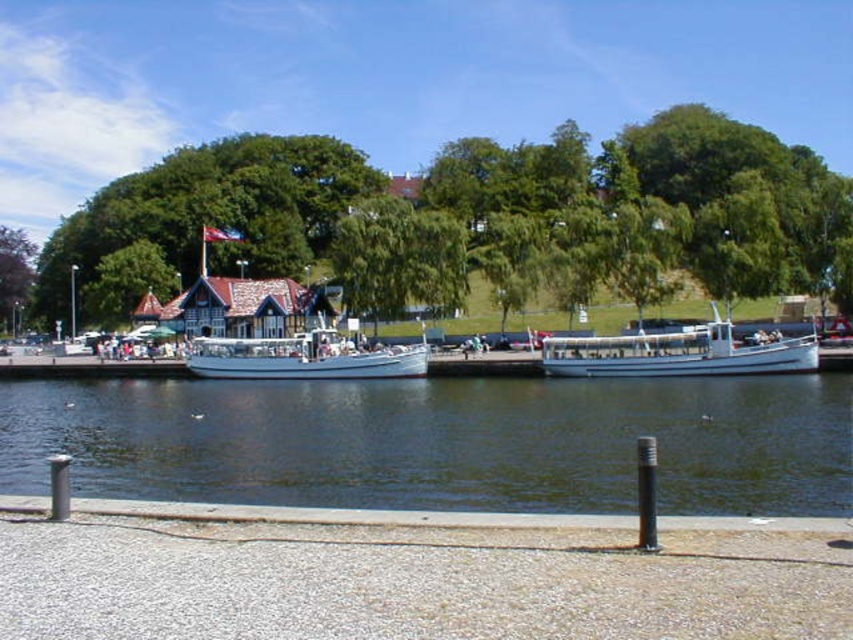
You are a photographer planning to take a photo of the green leafy tree at upper center and the white matte boat at right. Based on their sizes in the image, which object should you focus on first if you want to ensure both are in sharp focus?

The green leafy tree at upper center is larger in size than the white matte boat at right, so you should focus on the green leafy tree at upper center first to ensure both are in sharp focus since it takes up more space in the frame.

You are standing on the riverside walkway and want to take a photo of the white matte boat at center. To ensure the clear water at lower center is visible in the background, should you position yourself closer to or farther from the boat?

To have the clear water at lower center in the background behind the white matte boat at center, you should position yourself closer to the boat. Since the water is in front of the boat, moving closer would keep it in the background while framing the boat in the foreground.

You are a photographer planning to take a photo of the white matte boat at right and the purple leafy tree at upper left. Based on their sizes in the image, which object should you focus on first if you want to ensure both are in sharp focus?

The white matte boat at right has a smaller size compared to the purple leafy tree at upper left, so you should focus on the smaller object first to ensure both are in sharp focus.